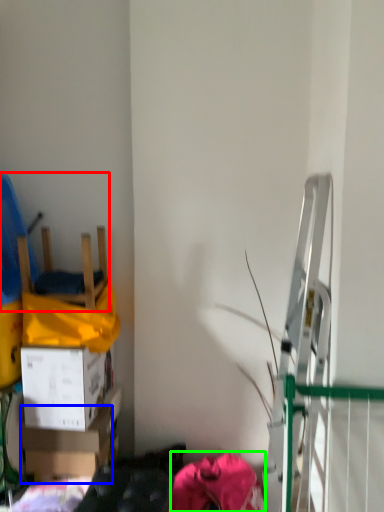
Question: Based on their relative distances, which object is nearer to chair (highlighted by a red box)? Choose from box (highlighted by a blue box) and clothing (highlighted by a green box).

Choices:
 (A) box
 (B) clothing

Answer: (A)